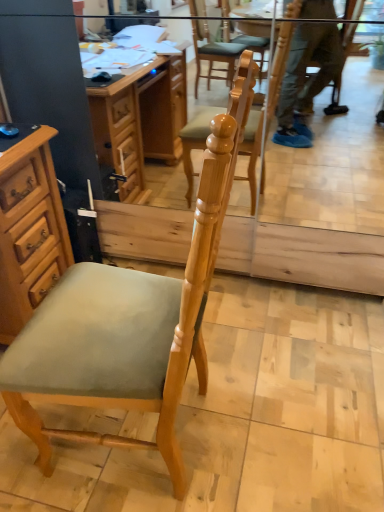
Question: Considering the relative sizes of wooden cabinet at left and light brown wood chair at center in the image provided, is wooden cabinet at left bigger than light brown wood chair at center?

Choices:
 (A) yes
 (B) no

Answer: (B)

Question: Is wooden cabinet at left located outside light brown wood chair at center?

Choices:
 (A) yes
 (B) no

Answer: (A)

Question: Is wooden cabinet at left positioned before light brown wood chair at center?

Choices:
 (A) yes
 (B) no

Answer: (B)

Question: Considering the relative sizes of wooden cabinet at left and light brown wood chair at center in the image provided, is wooden cabinet at left wider than light brown wood chair at center?

Choices:
 (A) no
 (B) yes

Answer: (A)

Question: Could light brown wood chair at center be considered to be inside wooden cabinet at left?

Choices:
 (A) no
 (B) yes

Answer: (A)

Question: Is wooden cabinet at left positioned with its back to light brown wood chair at center?

Choices:
 (A) no
 (B) yes

Answer: (A)

Question: Is the surface of light brown wood chair at center in direct contact with wooden cabinet at left?

Choices:
 (A) no
 (B) yes

Answer: (A)

Question: Is wooden cabinet at left surrounded by light brown wood chair at center?

Choices:
 (A) yes
 (B) no

Answer: (B)

Question: Could you tell me if light brown wood chair at center is turned towards wooden cabinet at left?

Choices:
 (A) no
 (B) yes

Answer: (B)

Question: Is light brown wood chair at center taller than wooden cabinet at left?

Choices:
 (A) yes
 (B) no

Answer: (A)

Question: Considering the relative sizes of light brown wood chair at center and wooden cabinet at left in the image provided, is light brown wood chair at center wider than wooden cabinet at left?

Choices:
 (A) yes
 (B) no

Answer: (A)

Question: Would you say light brown wood chair at center is outside wooden cabinet at left?

Choices:
 (A) no
 (B) yes

Answer: (B)

Question: In the image, is light brown wood chair at center positioned in front of or behind wooden cabinet at left?

Choices:
 (A) behind
 (B) front

Answer: (B)